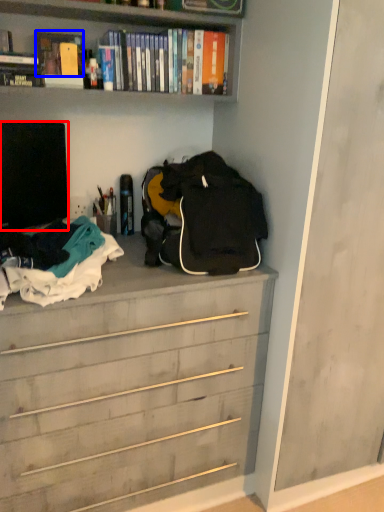
Question: Which of the following is the farthest to the observer, television (highlighted by a red box) or book (highlighted by a blue box)?

Choices:
 (A) television
 (B) book

Answer: (B)